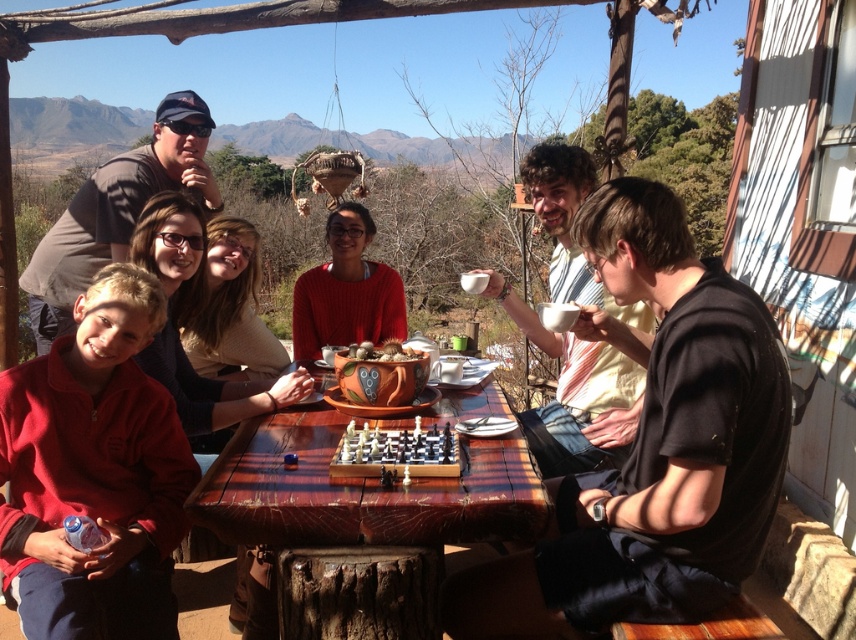
Question: Which object appears closest to the camera in this image?

Choices:
 (A) matte black mug at center
 (B) matte red sweater at center

Answer: (A)

Question: Is wooden table at center bigger than wooden chess set at center?

Choices:
 (A) yes
 (B) no

Answer: (A)

Question: Is wooden chess set at center smaller than smooth clay pot at center?

Choices:
 (A) yes
 (B) no

Answer: (B)

Question: Can you confirm if matte black mug at center is thinner than smooth clay pot at center?

Choices:
 (A) no
 (B) yes

Answer: (A)

Question: Which object appears farthest from the camera in this image?

Choices:
 (A) smooth clay pot at center
 (B) matte black mug at center
 (C) matte red sweater at center

Answer: (C)

Question: Which object is farther from the camera taking this photo?

Choices:
 (A) matte brown shirt at upper left
 (B) matte black mug at center

Answer: (A)